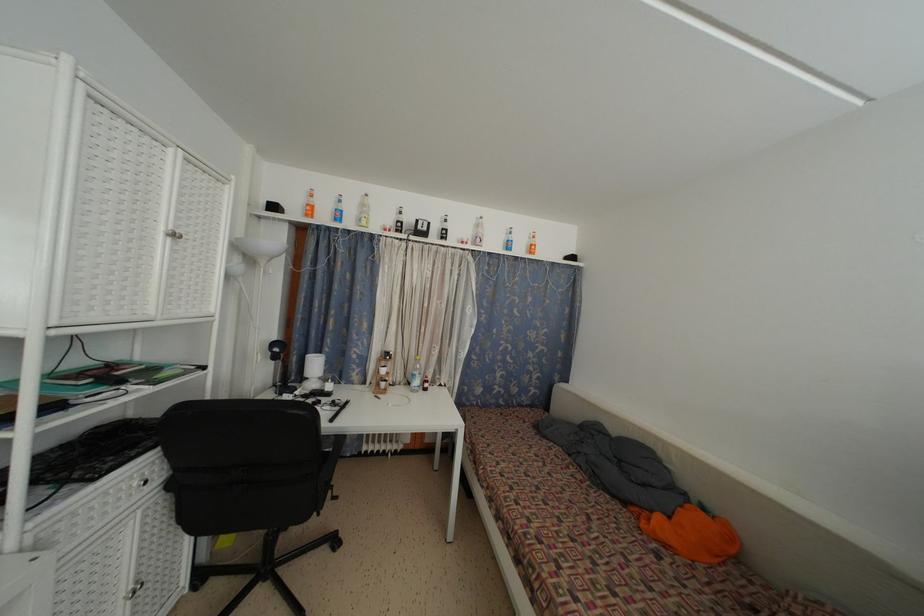
The location [362,211] corresponds to which object?

This point indicates the plastic water bottle.